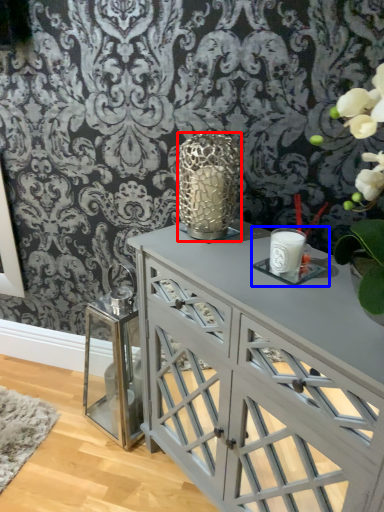
Question: Among these objects, which one is nearest to the camera, candle holder (highlighted by a red box) or candle holder (highlighted by a blue box)?

Choices:
 (A) candle holder
 (B) candle holder

Answer: (B)